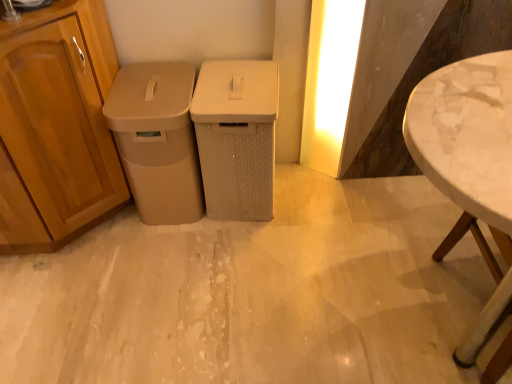
Image resolution: width=512 pixels, height=384 pixels. I want to click on free space above beige textured waste bin at center, which appears as the second waste container when viewed from the left (from a real-world perspective), so click(234, 92).